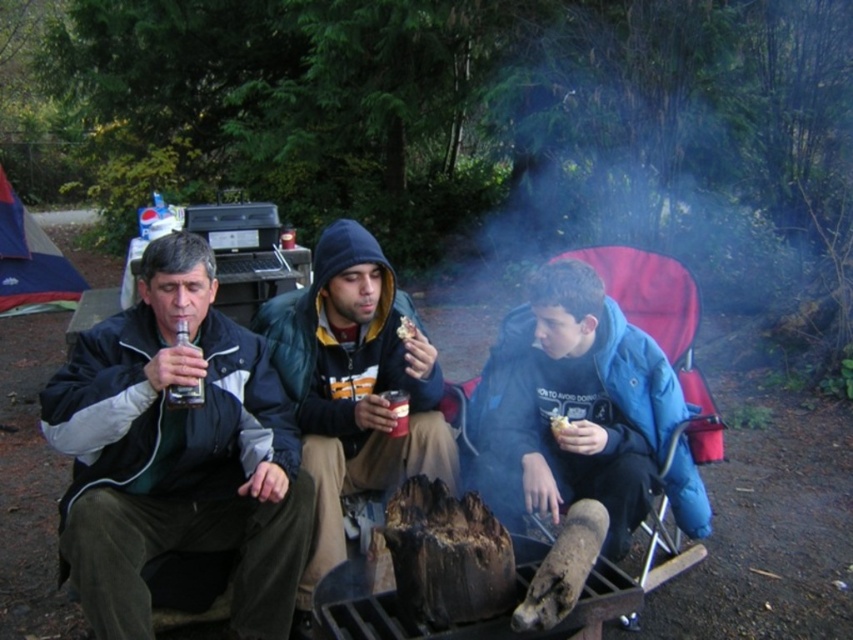
Question: Does blue fleece jacket at center have a smaller size compared to translucent glass bottle at center?

Choices:
 (A) no
 (B) yes

Answer: (A)

Question: Does dark green jacket at left appear on the right side of blue fleece jacket at center?

Choices:
 (A) yes
 (B) no

Answer: (B)

Question: Which object is positioned closest to the smooth brown bread at center?

Choices:
 (A) blue fleece jacket at center
 (B) white crumbly bread at center

Answer: (B)

Question: Which of these objects is positioned closest to the charcoal black log at center?

Choices:
 (A) blue fleece jacket at center
 (B) dark green jacket at left
 (C) white crumbly bread at center
 (D) smooth brown bread at center

Answer: (A)

Question: Among these points, which one is farthest from the camera?

Choices:
 (A) (184, 339)
 (B) (199, 276)
 (C) (312, 273)
 (D) (506, 580)

Answer: (C)

Question: Does blue fleece jacket at center appear under charcoal black log at center?

Choices:
 (A) no
 (B) yes

Answer: (A)